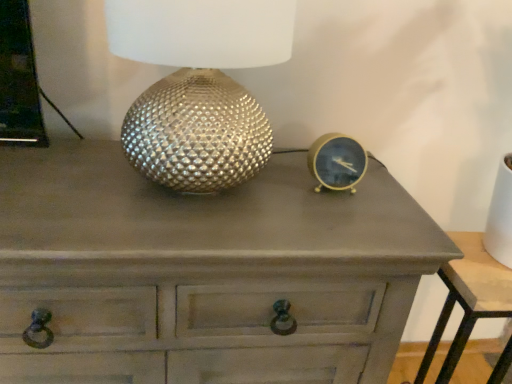
Identify the location of metallic textured lamp at center. The height and width of the screenshot is (384, 512). (199, 86).

Is metallic textured lamp at center not inside matte gray nightstand at lower right?

metallic textured lamp at center lies outside matte gray nightstand at lower right's area.

Who is shorter, metallic textured lamp at center or matte gray nightstand at lower right?

metallic textured lamp at center is shorter.

In the image, there is a metallic textured lamp at center. Find the location of `nightstand below it (from a real-world perspective)`. nightstand below it (from a real-world perspective) is located at coordinates (468, 298).

Based on the photo, who is bigger, metallic textured lamp at center or matte gray nightstand at lower right?

With larger size is matte gray nightstand at lower right.

Which of these two, matte gray nightstand at lower right or matte gray chest of drawers at center, is wider?

matte gray chest of drawers at center is wider.

From a real-world perspective, is matte gray nightstand at lower right located higher than matte gray chest of drawers at center?

Incorrect, from a real-world perspective, matte gray nightstand at lower right is lower than matte gray chest of drawers at center.

Can matte gray chest of drawers at center be found inside matte gray nightstand at lower right?

No, matte gray chest of drawers at center is located outside of matte gray nightstand at lower right.

Between matte gray nightstand at lower right and matte gray chest of drawers at center, which one has larger size?

matte gray chest of drawers at center is bigger.

Looking at this image, can you confirm if matte gray nightstand at lower right is smaller than gold metallic clock at right?

No, matte gray nightstand at lower right is not smaller than gold metallic clock at right.

Based on the photo, is matte gray nightstand at lower right facing away from gold metallic clock at right?

No, matte gray nightstand at lower right is not facing the opposite direction of gold metallic clock at right.

Considering the relative positions of matte gray nightstand at lower right and gold metallic clock at right in the image provided, is matte gray nightstand at lower right to the left of gold metallic clock at right from the viewer's perspective?

Incorrect, matte gray nightstand at lower right is not on the left side of gold metallic clock at right.

Where is `pocket watch in front of the matte gray nightstand at lower right`? The image size is (512, 384). pocket watch in front of the matte gray nightstand at lower right is located at coordinates (337, 162).

Is matte gray nightstand at lower right located outside metallic textured lamp at center?

matte gray nightstand at lower right lies outside metallic textured lamp at center's area.

From the image's perspective, does matte gray nightstand at lower right appear higher than metallic textured lamp at center?

No, from the image's perspective, matte gray nightstand at lower right is not above metallic textured lamp at center.

Which of these two, matte gray nightstand at lower right or metallic textured lamp at center, is wider?

Wider between the two is matte gray nightstand at lower right.

Between matte gray nightstand at lower right and metallic textured lamp at center, which one has more height?

matte gray nightstand at lower right.

Considering the sizes of objects metallic textured lamp at center and matte gray chest of drawers at center in the image provided, who is shorter, metallic textured lamp at center or matte gray chest of drawers at center?

→ With less height is metallic textured lamp at center.

Based on the photo, can you confirm if metallic textured lamp at center is positioned to the right of matte gray chest of drawers at center?

Indeed, metallic textured lamp at center is positioned on the right side of matte gray chest of drawers at center.

Is metallic textured lamp at center directly adjacent to matte gray chest of drawers at center?

metallic textured lamp at center and matte gray chest of drawers at center are clearly separated.

Locate an element on the screen. the chest of drawers lying in front of the metallic textured lamp at center is located at coordinates (205, 271).

Looking at this image, what's the angular difference between gold metallic clock at right and metallic textured lamp at center's facing directions?

0.00893 degrees.

From a real-world perspective, is gold metallic clock at right positioned above or below metallic textured lamp at center?

gold metallic clock at right is situated lower than metallic textured lamp at center in the real world.

Considering the sizes of objects gold metallic clock at right and metallic textured lamp at center in the image provided, who is wider, gold metallic clock at right or metallic textured lamp at center?

With larger width is metallic textured lamp at center.

Is gold metallic clock at right positioned before metallic textured lamp at center?

No, it is not.

Considering the sizes of gold metallic clock at right and matte gray nightstand at lower right in the image, is gold metallic clock at right wider or thinner than matte gray nightstand at lower right?

Considering their sizes, gold metallic clock at right looks slimmer than matte gray nightstand at lower right.

From the picture: Are gold metallic clock at right and matte gray nightstand at lower right making contact?

No, gold metallic clock at right is not in contact with matte gray nightstand at lower right.

Can you confirm if gold metallic clock at right is bigger than matte gray nightstand at lower right?

Actually, gold metallic clock at right might be smaller than matte gray nightstand at lower right.

This screenshot has width=512, height=384. I want to click on nightstand lying on the right of metallic textured lamp at center, so click(x=468, y=298).

Image resolution: width=512 pixels, height=384 pixels. What are the coordinates of `nightstand below the matte gray chest of drawers at center (from the image's perspective)` in the screenshot? It's located at (468, 298).

Looking at the image, which one is located closer to matte gray chest of drawers at center, matte gray nightstand at lower right or gold metallic clock at right?

gold metallic clock at right.

Which object lies further to the anchor point metallic textured lamp at center, matte gray nightstand at lower right or gold metallic clock at right?

matte gray nightstand at lower right is further to metallic textured lamp at center.

Which object lies further to the anchor point gold metallic clock at right, matte gray nightstand at lower right or matte gray chest of drawers at center?

matte gray nightstand at lower right lies further to gold metallic clock at right than the other object.

Based on the photo, considering their positions, is metallic textured lamp at center positioned further to gold metallic clock at right than matte gray chest of drawers at center?

matte gray chest of drawers at center is further to gold metallic clock at right.

Which object lies further to the anchor point matte gray nightstand at lower right, metallic textured lamp at center or matte gray chest of drawers at center?

metallic textured lamp at center lies further to matte gray nightstand at lower right than the other object.

Looking at this image, looking at the image, which one is located closer to matte gray nightstand at lower right, matte gray chest of drawers at center or metallic textured lamp at center?

matte gray chest of drawers at center is closer to matte gray nightstand at lower right.

Estimate the real-world distances between objects in this image. Which object is further from gold metallic clock at right, matte gray nightstand at lower right or metallic textured lamp at center?

matte gray nightstand at lower right.

Based on their spatial positions, is matte gray chest of drawers at center or gold metallic clock at right further from matte gray nightstand at lower right?

Among the two, matte gray chest of drawers at center is located further to matte gray nightstand at lower right.

Locate an element on the screen. Image resolution: width=512 pixels, height=384 pixels. table lamp situated between matte gray chest of drawers at center and matte gray nightstand at lower right from left to right is located at coordinates coord(199,86).

Where is `pocket watch between metallic textured lamp at center and matte gray nightstand at lower right`? pocket watch between metallic textured lamp at center and matte gray nightstand at lower right is located at coordinates (337, 162).

This screenshot has width=512, height=384. Find the location of `pocket watch between matte gray chest of drawers at center and matte gray nightstand at lower right`. pocket watch between matte gray chest of drawers at center and matte gray nightstand at lower right is located at coordinates (337, 162).

Where is `pocket watch that lies between metallic textured lamp at center and matte gray chest of drawers at center from top to bottom`? pocket watch that lies between metallic textured lamp at center and matte gray chest of drawers at center from top to bottom is located at coordinates (x=337, y=162).